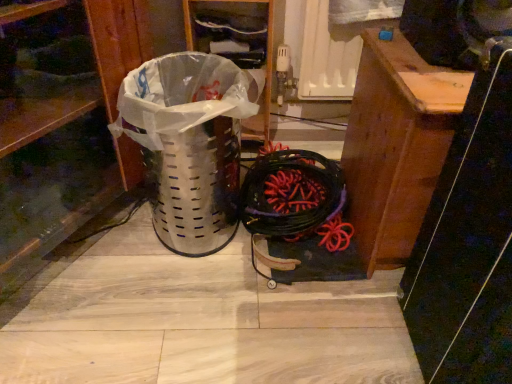
Where is `black rubber battle rope at center`? This screenshot has width=512, height=384. black rubber battle rope at center is located at coordinates (295, 197).

Identify the location of brushed metal trash can at left. (67, 137).

Can you confirm if wooden plank at center is thinner than brushed metal trash can at left?

Indeed, wooden plank at center has a lesser width compared to brushed metal trash can at left.

The height and width of the screenshot is (384, 512). In order to click on furniture below the brushed metal trash can at left (from the image's perspective) in this screenshot , I will do `click(396, 145)`.

Based on the photo, which of these two, wooden plank at center or brushed metal trash can at left, is smaller?

wooden plank at center.

Considering the sizes of objects wooden plank at center and brushed metal trash can at left in the image provided, who is shorter, wooden plank at center or brushed metal trash can at left?

wooden plank at center.

Is brushed metal trash can at left spatially inside metallic perforated trash can at left, or outside of it?

brushed metal trash can at left cannot be found inside metallic perforated trash can at left.

Between brushed metal trash can at left and metallic perforated trash can at left, which one has larger width?

With larger width is brushed metal trash can at left.

From the image's perspective, is brushed metal trash can at left positioned above or below metallic perforated trash can at left?

brushed metal trash can at left is above metallic perforated trash can at left.

From a real-world perspective, which is physically below, brushed metal trash can at left or metallic perforated trash can at left?

metallic perforated trash can at left.

Where is `furniture above the black rubber battle rope at center (from the image's perspective)`? Image resolution: width=512 pixels, height=384 pixels. furniture above the black rubber battle rope at center (from the image's perspective) is located at coordinates point(396,145).

Is black rubber battle rope at center surrounded by wooden plank at center?

No, black rubber battle rope at center is not surrounded by wooden plank at center.

Is wooden plank at center aimed at black rubber battle rope at center?

No, wooden plank at center does not turn towards black rubber battle rope at center.

From the image's perspective, who appears lower, black rubber battle rope at center or brushed metal trash can at left?

black rubber battle rope at center appears lower in the image.

Is black rubber battle rope at center in contact with brushed metal trash can at left?

black rubber battle rope at center and brushed metal trash can at left are clearly separated.

Which is in front, point (277, 195) or point (35, 204)?

Point (35, 204)

From a real-world perspective, is black rubber battle rope at center located higher than brushed metal trash can at left?

No, from a real-world perspective, black rubber battle rope at center is not on top of brushed metal trash can at left.

Is point (50, 162) closer to viewer compared to point (300, 209)?

Yes, it is.

Can you tell me how much brushed metal trash can at left and black rubber battle rope at center differ in facing direction?

They differ by 59.7 degrees in their facing directions.

Is brushed metal trash can at left inside the boundaries of black rubber battle rope at center, or outside?

brushed metal trash can at left exists outside the volume of black rubber battle rope at center.

Where is `battle rope on the right of brushed metal trash can at left`? battle rope on the right of brushed metal trash can at left is located at coordinates (295, 197).

Based on the photo, is metallic perforated trash can at left behind wooden plank at center?

Yes, metallic perforated trash can at left is behind wooden plank at center.

What's the angular difference between metallic perforated trash can at left and wooden plank at center's facing directions?

33.5 degrees separate the facing orientations of metallic perforated trash can at left and wooden plank at center.

Is metallic perforated trash can at left facing away from wooden plank at center?

No.

Can we say metallic perforated trash can at left lies outside wooden plank at center?

Yes, metallic perforated trash can at left is located beyond the bounds of wooden plank at center.

Considering the positions of point (382, 228) and point (164, 228), is point (382, 228) closer or farther from the camera than point (164, 228)?

Point (382, 228) appears to be closer to the viewer than point (164, 228).

Considering the sizes of wooden plank at center and metallic perforated trash can at left in the image, is wooden plank at center wider or thinner than metallic perforated trash can at left?

wooden plank at center is wider than metallic perforated trash can at left.

Is wooden plank at center far away from metallic perforated trash can at left?

No, there isn't a large distance between wooden plank at center and metallic perforated trash can at left.

From the image's perspective, is wooden plank at center positioned above or below metallic perforated trash can at left?

Based on their image positions, wooden plank at center is located above metallic perforated trash can at left.

The image size is (512, 384). I want to click on furniture on the right of brushed metal trash can at left, so click(x=396, y=145).

Identify the location of shelf that is above the metallic perforated trash can at left (from the image's perspective). This screenshot has width=512, height=384. (67, 137).

Estimate the real-world distances between objects in this image. Which object is further from metallic perforated trash can at left, brushed metal trash can at left or black rubber battle rope at center?

Among the two, black rubber battle rope at center is located further to metallic perforated trash can at left.

When comparing their distances from brushed metal trash can at left, does black rubber battle rope at center or wooden plank at center seem further?

wooden plank at center is positioned further to the anchor brushed metal trash can at left.

Based on their spatial positions, is wooden plank at center or brushed metal trash can at left closer to metallic perforated trash can at left?

Among the two, brushed metal trash can at left is located nearer to metallic perforated trash can at left.

Estimate the real-world distances between objects in this image. Which object is further from brushed metal trash can at left, metallic perforated trash can at left or black rubber battle rope at center?

Based on the image, black rubber battle rope at center appears to be further to brushed metal trash can at left.

From the image, which object appears to be nearer to metallic perforated trash can at left, brushed metal trash can at left or wooden plank at center?

Among the two, brushed metal trash can at left is located nearer to metallic perforated trash can at left.

Estimate the real-world distances between objects in this image. Which object is further from black rubber battle rope at center, metallic perforated trash can at left or wooden plank at center?

Based on the image, metallic perforated trash can at left appears to be further to black rubber battle rope at center.

From the image, which object appears to be farther from black rubber battle rope at center, brushed metal trash can at left or wooden plank at center?

brushed metal trash can at left is further to black rubber battle rope at center.

From the image, which object appears to be farther from black rubber battle rope at center, metallic perforated trash can at left or brushed metal trash can at left?

Among the two, brushed metal trash can at left is located further to black rubber battle rope at center.

Find the location of `garbage between brushed metal trash can at left and wooden plank at center from left to right`. garbage between brushed metal trash can at left and wooden plank at center from left to right is located at coordinates (189, 144).

What are the coordinates of `garbage between brushed metal trash can at left and black rubber battle rope at center` in the screenshot? It's located at (189, 144).

Where is `battle rope between brushed metal trash can at left and wooden plank at center from left to right`? This screenshot has height=384, width=512. battle rope between brushed metal trash can at left and wooden plank at center from left to right is located at coordinates click(295, 197).

Find the location of a particular element. The height and width of the screenshot is (384, 512). battle rope between metallic perforated trash can at left and wooden plank at center from left to right is located at coordinates (295, 197).